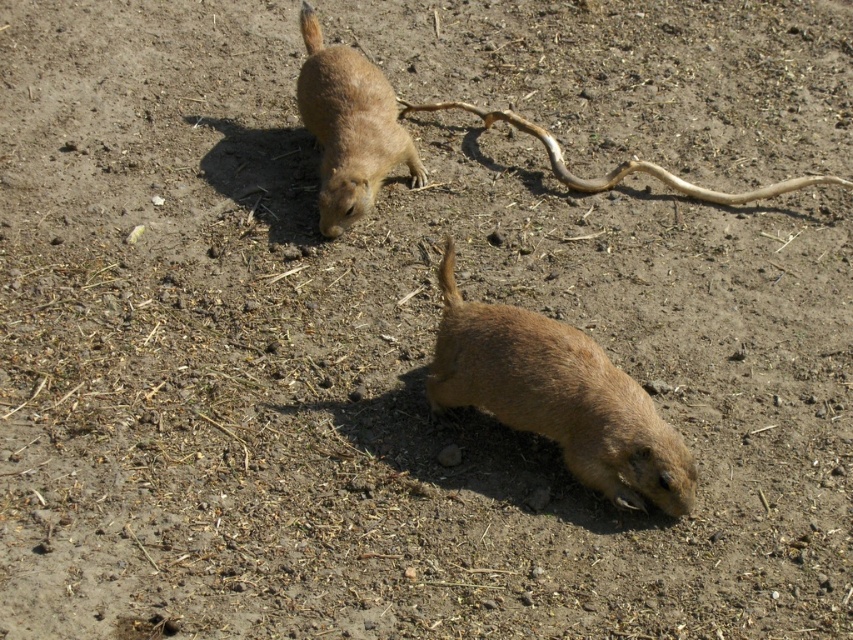
Question: Is brown fur tail at lower center above brown fur tail at upper center?

Choices:
 (A) no
 (B) yes

Answer: (A)

Question: Which object is closer to the camera taking this photo?

Choices:
 (A) brown fur tail at lower center
 (B) brown furry ground squirrel at lower center
 (C) brown furry ground squirrel at upper center

Answer: (B)

Question: Can you confirm if brown furry ground squirrel at lower center is smaller than brown furry ground squirrel at upper center?

Choices:
 (A) yes
 (B) no

Answer: (B)

Question: Estimate the real-world distances between objects in this image. Which object is closer to the brown furry ground squirrel at upper center?

Choices:
 (A) brown fur tail at upper center
 (B) brown furry ground squirrel at lower center
 (C) brown fur tail at lower center

Answer: (A)

Question: Which point is closer to the camera?

Choices:
 (A) brown fur tail at lower center
 (B) brown fur tail at upper center
 (C) brown furry ground squirrel at lower center

Answer: (C)

Question: Can you confirm if brown furry ground squirrel at upper center is positioned to the right of brown fur tail at lower center?

Choices:
 (A) yes
 (B) no

Answer: (B)